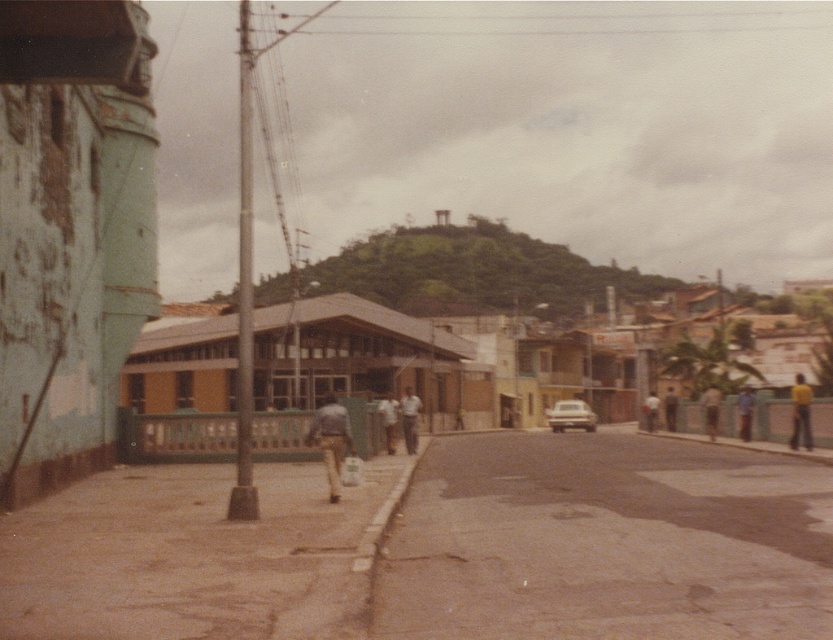
Question: Considering the relative positions of brown asphalt road at center and brown leather jacket at center in the image provided, where is brown asphalt road at center located with respect to brown leather jacket at center?

Choices:
 (A) left
 (B) right

Answer: (A)

Question: In this image, where is light brown fabric pants at center located relative to brown leather jacket at center?

Choices:
 (A) left
 (B) right

Answer: (A)

Question: Which object is closer to the camera taking this photo?

Choices:
 (A) light brown fabric pants at center-right
 (B) dark blue jeans at center

Answer: (B)

Question: Does brown asphalt road at center have a larger size compared to dark blue jeans at center?

Choices:
 (A) yes
 (B) no

Answer: (A)

Question: Based on their relative distances, which object is farther from the brown asphalt road at center?

Choices:
 (A) brown leather jacket at center
 (B) silver metallic car at center
 (C) dark blue jeans at center

Answer: (B)

Question: Which object appears farthest from the camera in this image?

Choices:
 (A) light brown leather jacket at center
 (B) brown leather jacket at center

Answer: (B)